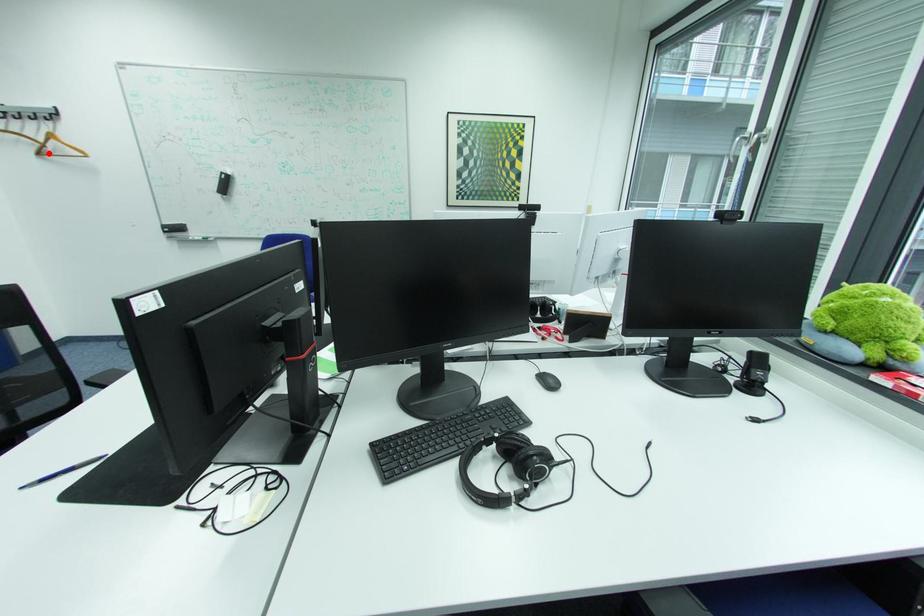
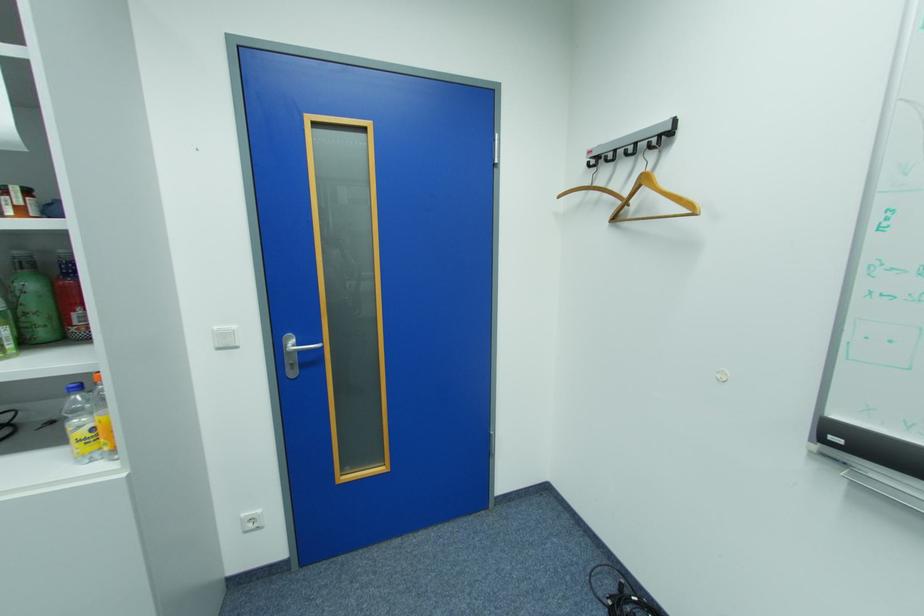
Question: I am providing you with two images of the same scene from different viewpoints. Given a red point in image1, look at the same physical point in image2. Is it:

Choices:
 (A) Closer to the viewpoint
 (B) Farther from the viewpoint

Answer: (A)